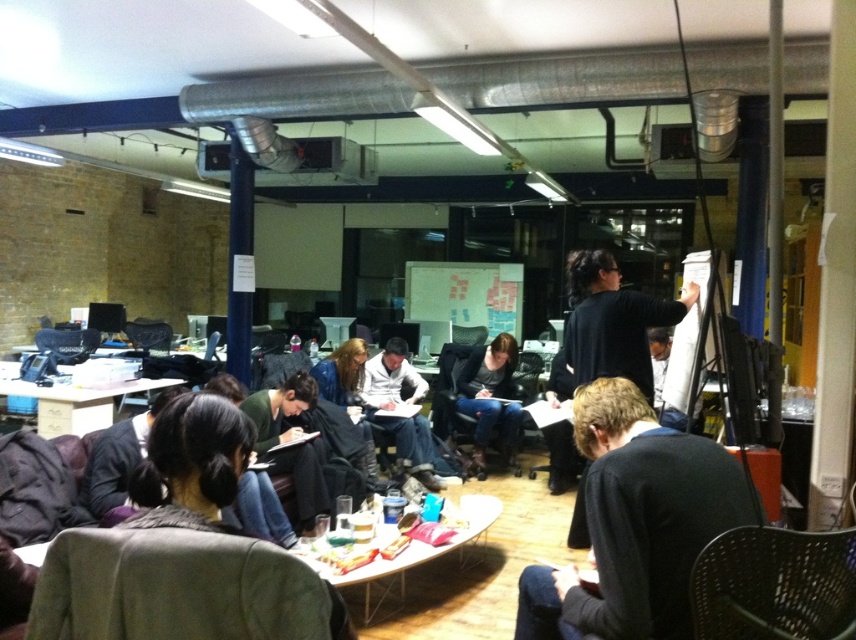
Question: Which of the following is the closest to the observer?

Choices:
 (A) (397, 426)
 (B) (42, 328)
 (C) (459, 372)

Answer: (A)

Question: Which point is farther to the camera?

Choices:
 (A) (616, 378)
 (B) (57, 355)
 (C) (780, 531)

Answer: (B)

Question: Which point is farther to the camera?

Choices:
 (A) black mesh chair at lower right
 (B) black sweater at lower right

Answer: (B)

Question: Does black sweater at lower right come behind denim jeans at center?

Choices:
 (A) yes
 (B) no

Answer: (B)

Question: Does matte white shirt at center lie in front of matte black chair at left?

Choices:
 (A) no
 (B) yes

Answer: (B)

Question: Is black sweater at lower right bigger than denim jeans at center?

Choices:
 (A) no
 (B) yes

Answer: (A)